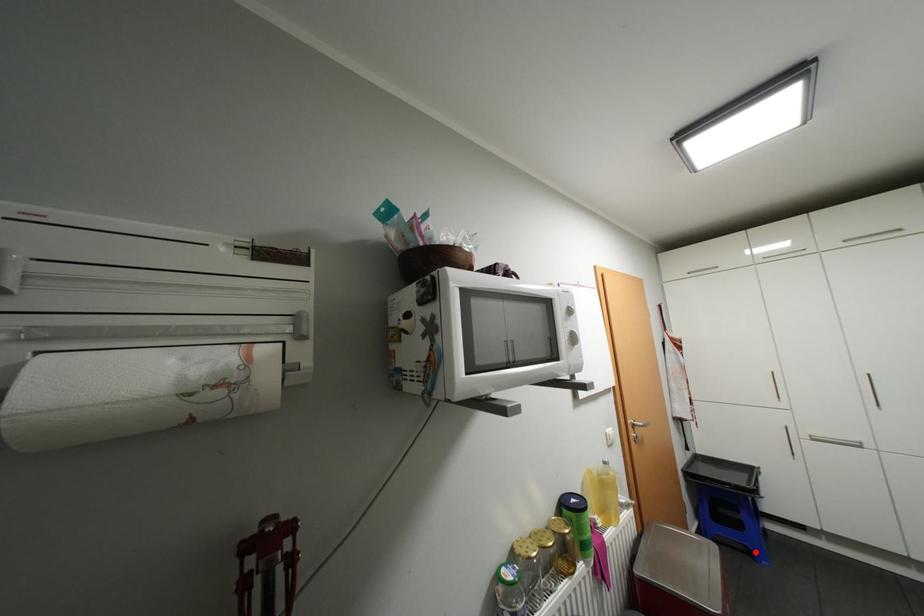
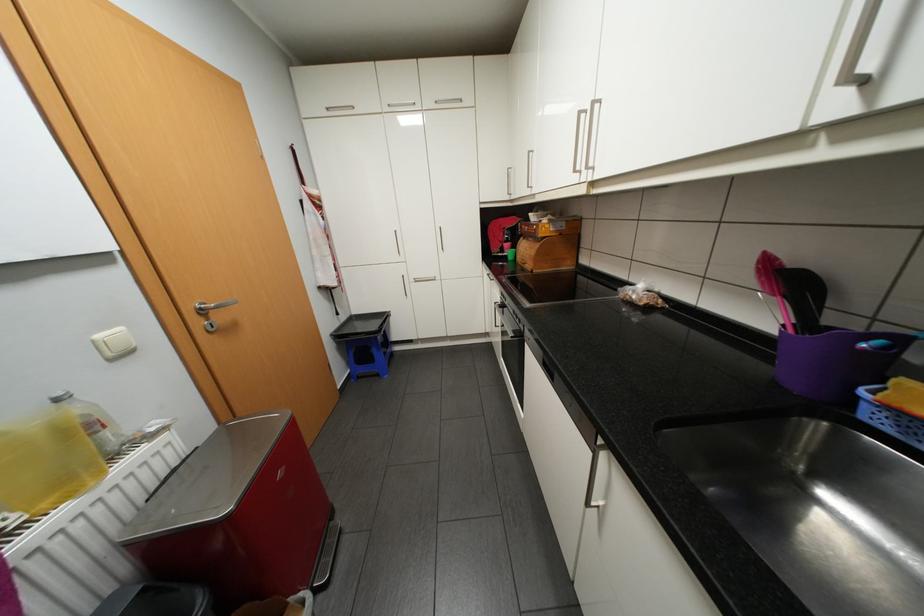
Locate, in the second image, the point that corresponds to the highlighted location in the first image.

(385, 374)